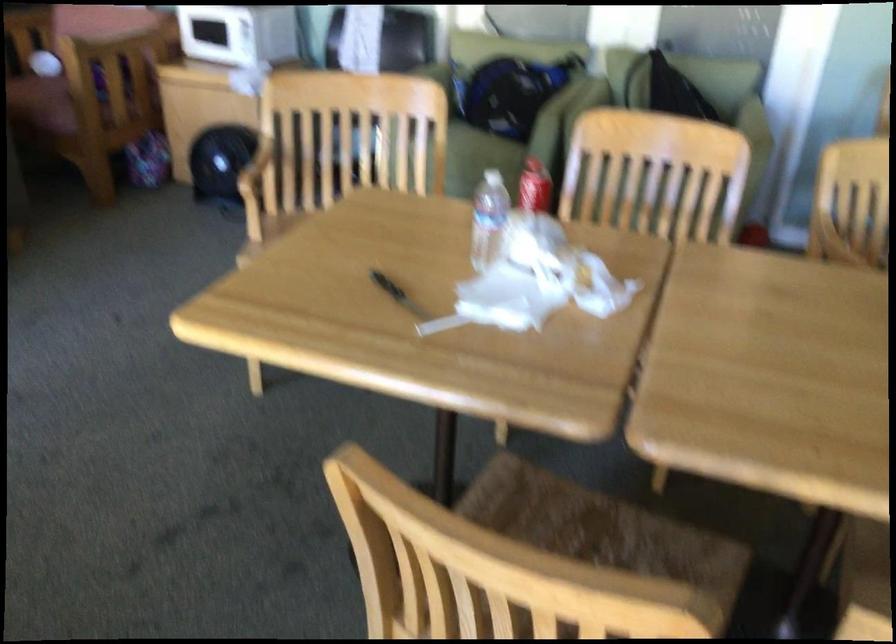
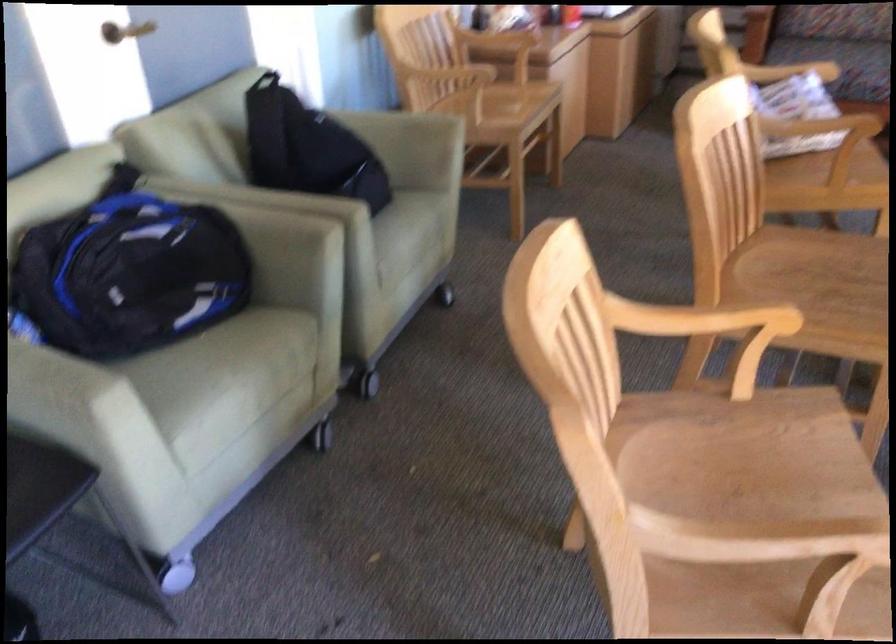
Question: I am providing you with two images of the same scene from different viewpoints. After the viewpoint changes to image2, which objects are now occluded?

Choices:
 (A) blue and black backpack
 (B) woven basket
 (C) chair armrest
 (D) sofa armrest

Answer: (C)